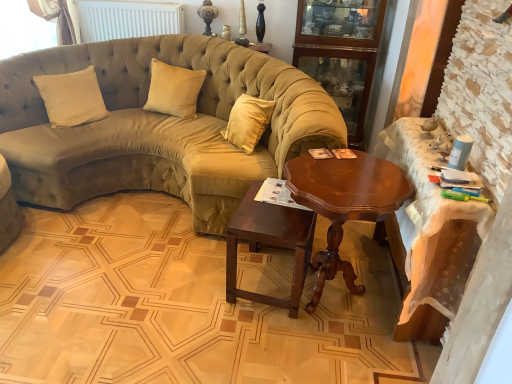
Question: Considering the positions of satin beige pillow at center, positioned as the second pillow in left-to-right order, and beige velvet pillow at center, the 2th pillow when ordered from right to left, in the image, is satin beige pillow at center, positioned as the second pillow in left-to-right order, taller or shorter than beige velvet pillow at center, the 2th pillow when ordered from right to left,?

Choices:
 (A) short
 (B) tall

Answer: (A)

Question: In the image, is satin beige pillow at center, placed as the 1th pillow when sorted from right to left, on the left side or the right side of beige velvet pillow at center, the 2th pillow when ordered from right to left?

Choices:
 (A) right
 (B) left

Answer: (A)

Question: Estimate the real-world distances between objects in this image. Which object is farther from the beige velvet pillow at center, acting as the first pillow starting from the left?

Choices:
 (A) white matte radiator at upper center
 (B) wooden table at right, arranged as the 2th table when viewed from the left
 (C) satin beige pillow at center, positioned as the second pillow in left-to-right order
 (D) shiny brown wood coffee table at center
 (E) velvet olive green couch at center

Answer: (B)

Question: Estimate the real-world distances between objects in this image. Which object is farther from the wooden cabinet at upper right?

Choices:
 (A) wooden table at right, arranged as the 2th table when viewed from the left
 (B) beige velvet pillow at center, acting as the first pillow starting from the left
 (C) satin beige pillow at center, positioned as the second pillow in left-to-right order
 (D) white matte radiator at upper center
 (E) shiny brown wood coffee table at center

Answer: (B)